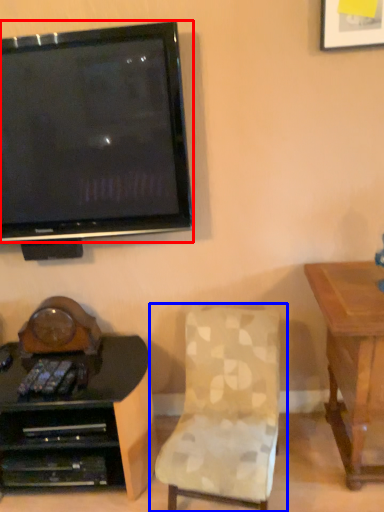
Question: Among these objects, which one is farthest to the camera, television (highlighted by a red box) or chair (highlighted by a blue box)?

Choices:
 (A) television
 (B) chair

Answer: (A)